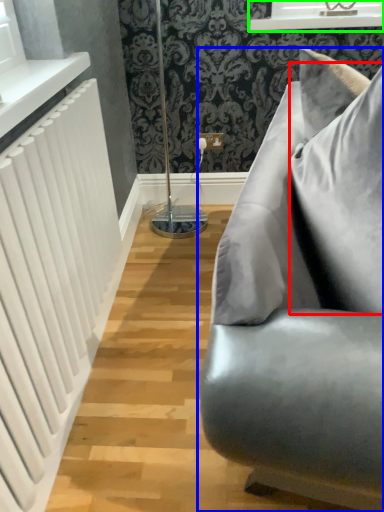
Question: Considering the real-world distances, which object is closest to pillow (highlighted by a red box)? studio couch (highlighted by a blue box) or window frame (highlighted by a green box).

Choices:
 (A) studio couch
 (B) window frame

Answer: (A)